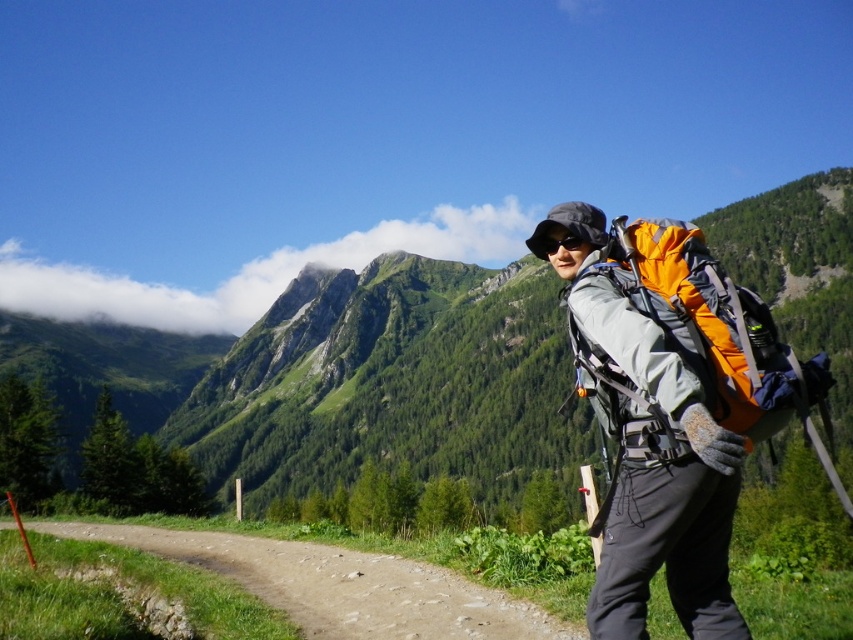
Consider the image. Can you confirm if green grassy mountain at center is positioned below matte gray jacket at center?

Actually, green grassy mountain at center is above matte gray jacket at center.

Is green grassy mountain at center thinner than matte gray jacket at center?

Incorrect, green grassy mountain at center's width is not less than matte gray jacket at center's.

Between point (461, 474) and point (631, 506), which one is positioned behind?

Point (461, 474)

Where is `green grassy mountain at center`? This screenshot has height=640, width=853. green grassy mountain at center is located at coordinates (340, 380).

From the picture: Can you confirm if dirt/gravel path at lower left is positioned to the right of black matte sunglasses at center?

Incorrect, dirt/gravel path at lower left is not on the right side of black matte sunglasses at center.

Is dirt/gravel path at lower left thinner than black matte sunglasses at center?

In fact, dirt/gravel path at lower left might be wider than black matte sunglasses at center.

Image resolution: width=853 pixels, height=640 pixels. What do you see at coordinates (340, 586) in the screenshot?
I see `dirt/gravel path at lower left` at bounding box center [340, 586].

In order to click on dirt/gravel path at lower left in this screenshot , I will do `click(340, 586)`.

Based on the photo, does orange fabric backpack at right have a lesser height compared to black matte sunglasses at center?

In fact, orange fabric backpack at right may be taller than black matte sunglasses at center.

Is orange fabric backpack at right behind black matte sunglasses at center?

No, it is in front of black matte sunglasses at center.

Is point (798, 380) positioned before point (540, 257)?

Yes.

Where is `orange fabric backpack at right`? The image size is (853, 640). orange fabric backpack at right is located at coordinates (705, 323).